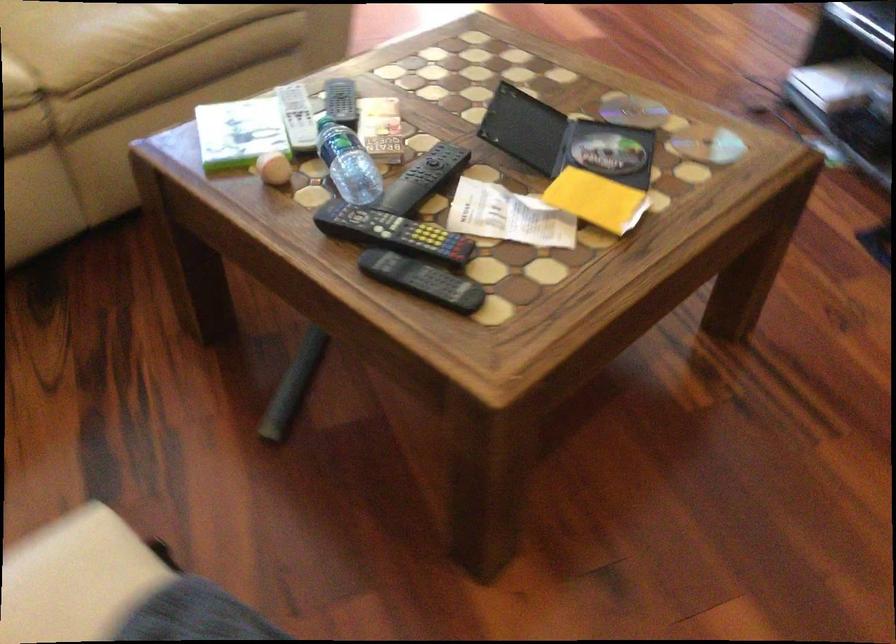
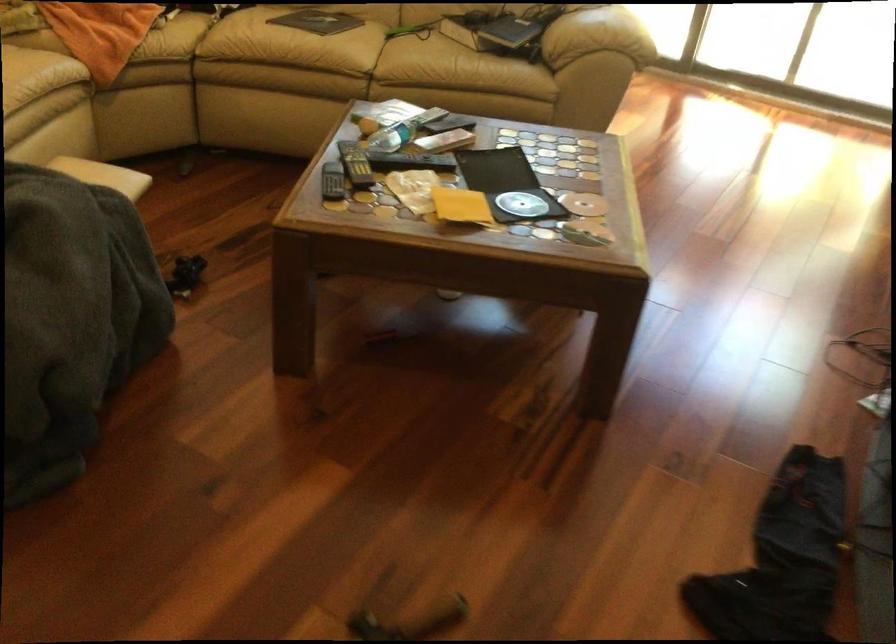
Where in the second image is the point corresponding to pixel 612 153 from the first image?

(521, 204)